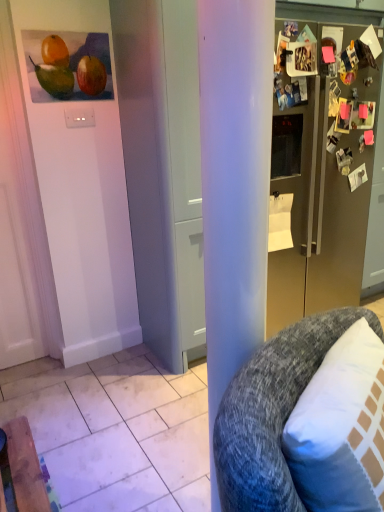
Question: Is gray textured cushion at right bigger than white matte door at center?

Choices:
 (A) no
 (B) yes

Answer: (A)

Question: Does gray textured cushion at right come in front of white matte door at center?

Choices:
 (A) no
 (B) yes

Answer: (B)

Question: Is gray textured cushion at right wider than white matte door at center?

Choices:
 (A) no
 (B) yes

Answer: (A)

Question: From the image's perspective, is gray textured cushion at right on top of white matte door at center?

Choices:
 (A) no
 (B) yes

Answer: (A)

Question: Is gray textured cushion at right thinner than white matte door at center?

Choices:
 (A) no
 (B) yes

Answer: (B)

Question: Is gray textured cushion at right with white matte door at center?

Choices:
 (A) yes
 (B) no

Answer: (B)

Question: Considering the relative sizes of satin gold refrigerator at right and gray textured cushion at right in the image provided, is satin gold refrigerator at right bigger than gray textured cushion at right?

Choices:
 (A) yes
 (B) no

Answer: (A)

Question: From a real-world perspective, is satin gold refrigerator at right below gray textured cushion at right?

Choices:
 (A) yes
 (B) no

Answer: (B)

Question: Does satin gold refrigerator at right lie behind gray textured cushion at right?

Choices:
 (A) no
 (B) yes

Answer: (B)

Question: Is satin gold refrigerator at right touching gray textured cushion at right?

Choices:
 (A) yes
 (B) no

Answer: (B)

Question: Is satin gold refrigerator at right closer to the viewer compared to gray textured cushion at right?

Choices:
 (A) yes
 (B) no

Answer: (B)

Question: Considering the relative sizes of satin gold refrigerator at right and gray textured cushion at right in the image provided, is satin gold refrigerator at right wider than gray textured cushion at right?

Choices:
 (A) yes
 (B) no

Answer: (B)

Question: From the image's perspective, is matte orange at upper left beneath satin gold refrigerator at right?

Choices:
 (A) no
 (B) yes

Answer: (A)